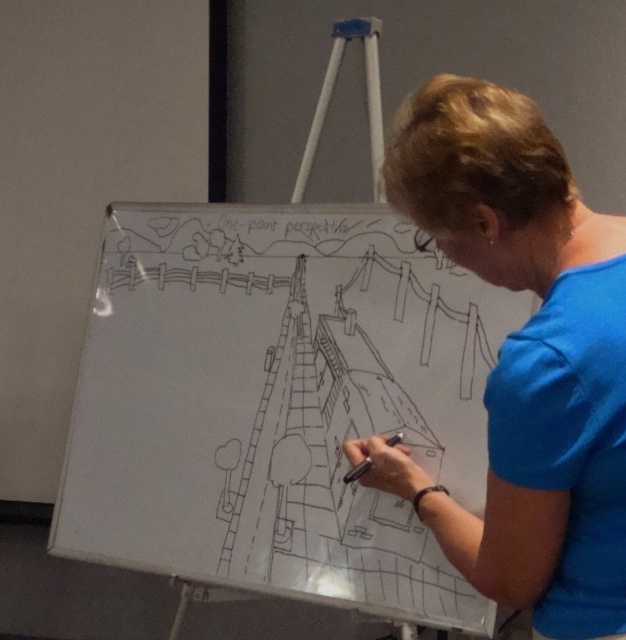
You are standing in front of the whiteboard and need to place a new drawing tool. The white paperboard at center and the blue fabric shirt at center are both in your view. Which object is lower in position?

The white paperboard at center is located below the blue fabric shirt at center, so the white paperboard at center is lower.

You are standing in front of the whiteboard and want to place a new drawing tool next to the white paperboard at center. Where should you place it so it stays to the right of the blue fabric shirt at center?

The white paperboard at center is to the left of the blue fabric shirt at center, so placing the new drawing tool to the right of the blue fabric shirt at center would position it further to the right compared to the white paperboard at center.

You are an art student observing the scene. You need to know which object is taller between the white paperboard at center and the black matte pen at center. Can you determine this based on the image?

The white paperboard at center is taller than the black matte pen at center according to the description.